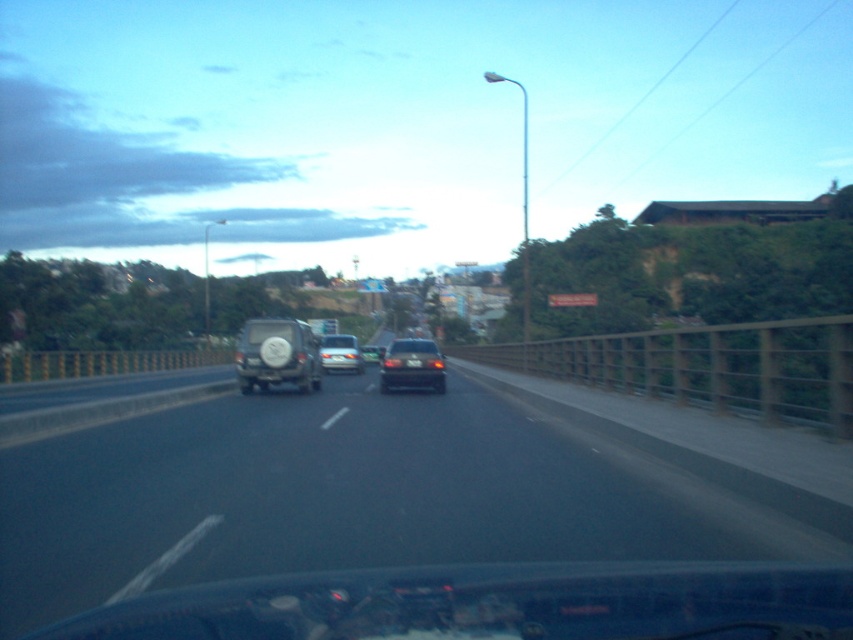
You are driving and see the black asphalt highway at center and the matte black suv at center. Which one is closer to the right side of the road?

The black asphalt highway at center is to the right of the matte black suv at center, so the black asphalt highway at center is closer to the right side of the road.

You are a passenger in the car and want to know which of the two points, point (381, 540) or point (276, 321), is closer to you. Based on the scene, can you determine which one is nearer?

Point (381, 540) is closer to the camera than point (276, 321), so it is nearer to you as a passenger in the car.

You are driving a car and see the black asphalt highway at center and the satin silver sedan at center ahead. Which one is closer to you?

The black asphalt highway at center is closer to you because it is positioned in front of the satin silver sedan at center.